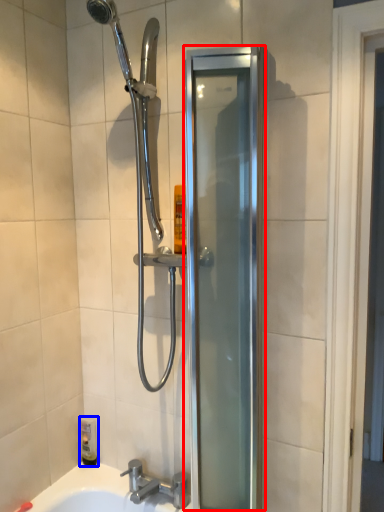
Question: Which of the following is the closest to the observer, screen door (highlighted by a red box) or toiletry (highlighted by a blue box)?

Choices:
 (A) screen door
 (B) toiletry

Answer: (A)